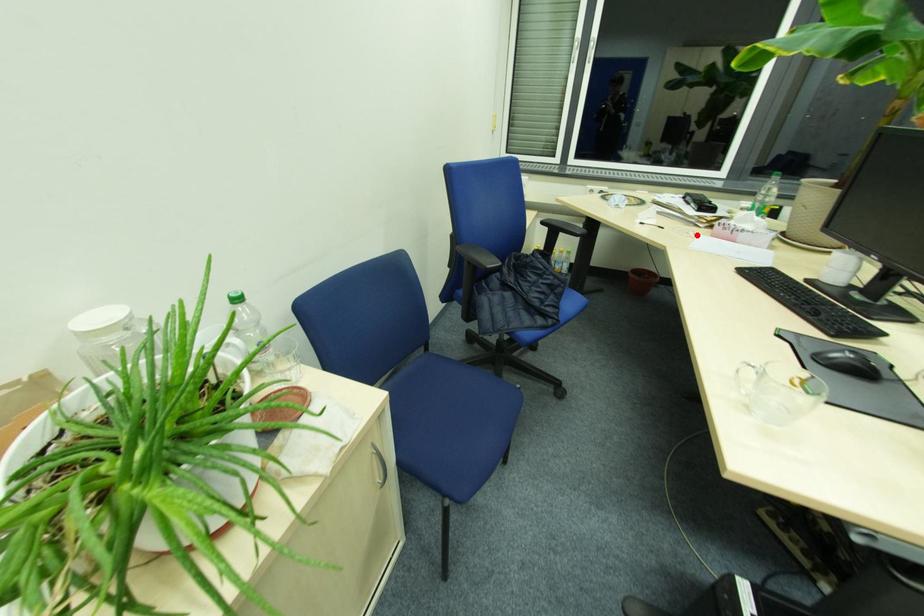
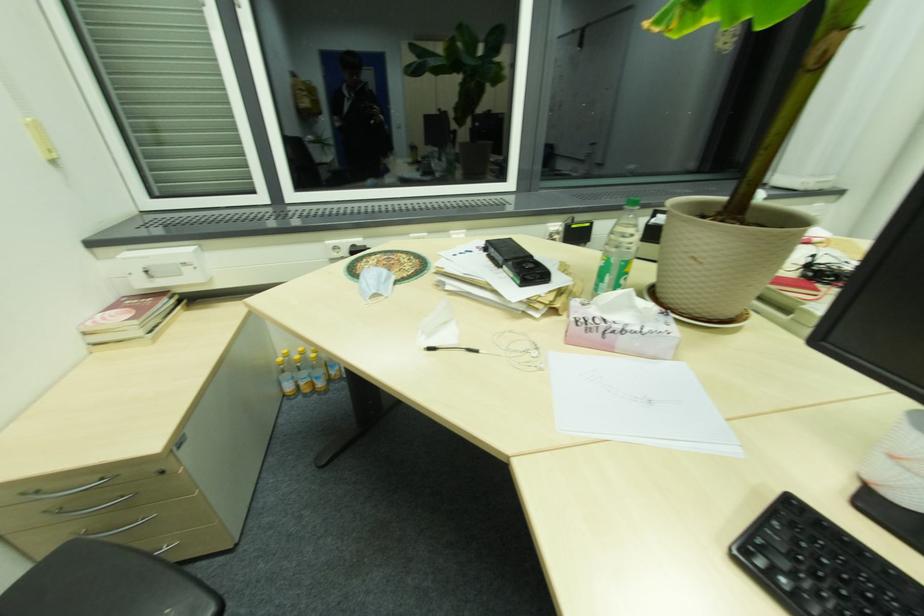
In the second image, find the point that corresponds to the highlighted location in the first image.

(540, 355)